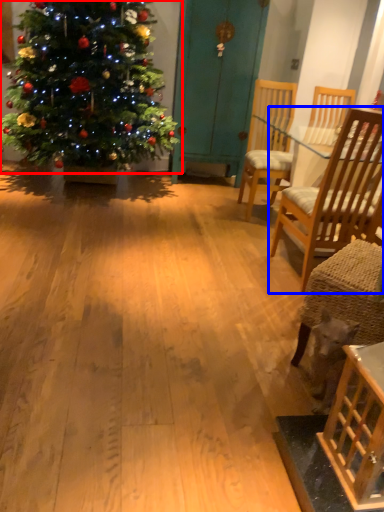
Question: Among these objects, which one is farthest to the camera, christmas tree (highlighted by a red box) or chair (highlighted by a blue box)?

Choices:
 (A) christmas tree
 (B) chair

Answer: (A)